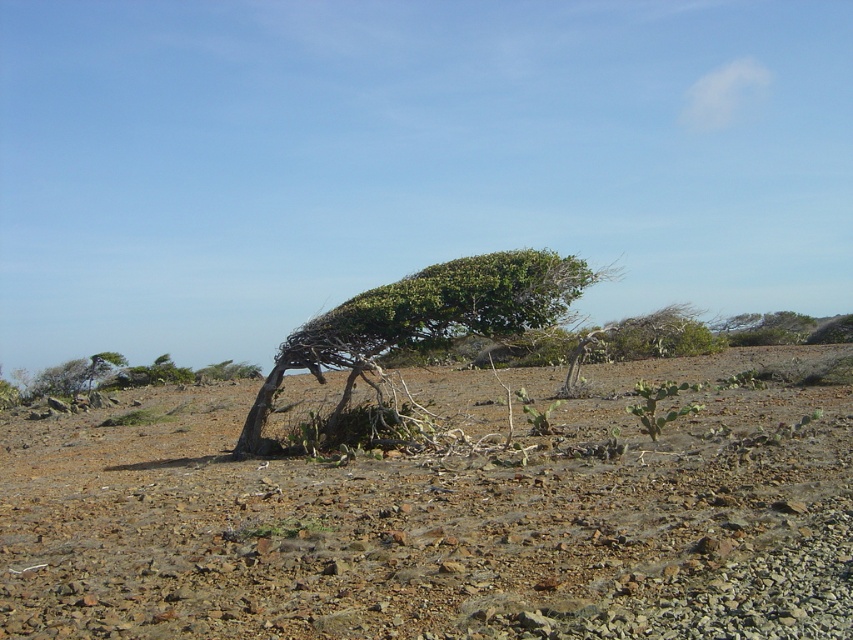
Question: Among these objects, which one is nearest to the camera?

Choices:
 (A) green leafy tree at center
 (B) brown rocky dirt field at center

Answer: (B)

Question: Is brown rocky dirt field at center thinner than green leafy tree at center?

Choices:
 (A) yes
 (B) no

Answer: (B)

Question: Observing the image, what is the correct spatial positioning of brown rocky dirt field at center in reference to green leafy tree at center?

Choices:
 (A) below
 (B) above

Answer: (A)

Question: Is brown rocky dirt field at center positioned at the back of green leafy tree at center?

Choices:
 (A) yes
 (B) no

Answer: (B)

Question: Among these points, which one is farthest from the camera?

Choices:
 (A) pos(409,550)
 (B) pos(490,284)

Answer: (B)